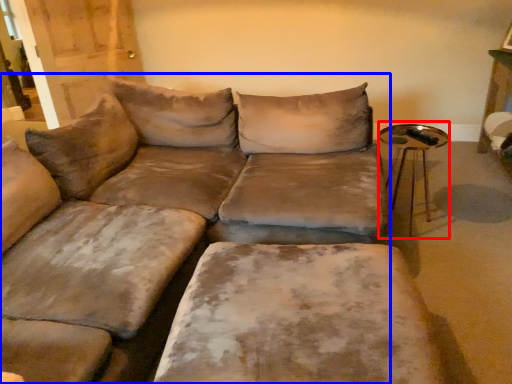
Question: Which of the following is the farthest to the observer, side table (highlighted by a red box) or studio couch (highlighted by a blue box)?

Choices:
 (A) side table
 (B) studio couch

Answer: (A)